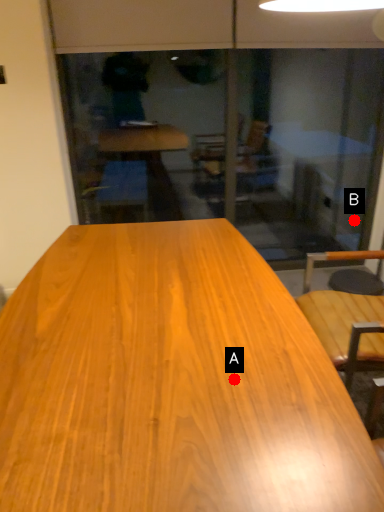
Question: Two points are circled on the image, labeled by A and B beside each circle. Which point is farther from the camera taking this photo?

Choices:
 (A) A is further
 (B) B is further

Answer: (B)